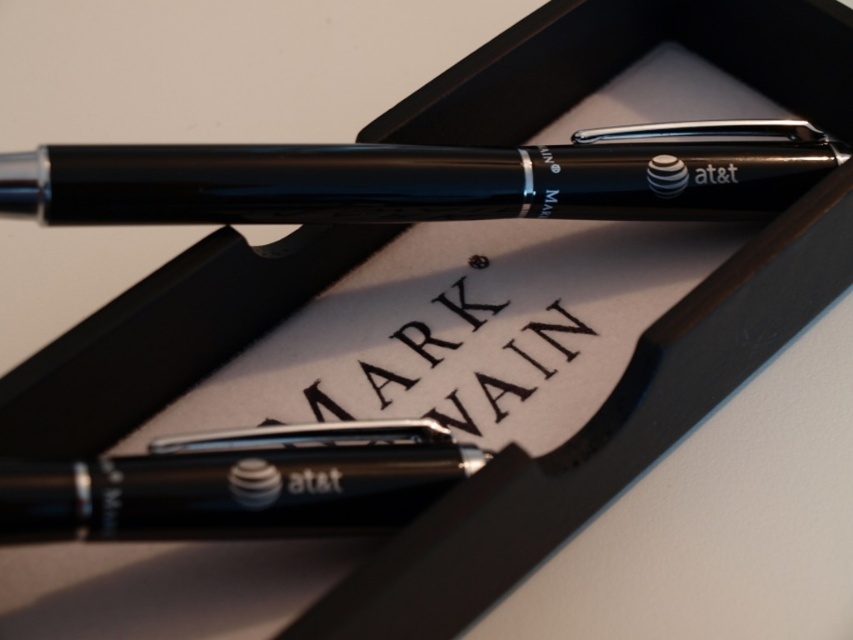
Question: Considering the relative positions of matte black pen at upper center and black metallic pen at center in the image provided, where is matte black pen at upper center located with respect to black metallic pen at center?

Choices:
 (A) below
 (B) above

Answer: (B)

Question: Which point is closer to the camera?

Choices:
 (A) black metallic pen at center
 (B) matte black pen at upper center

Answer: (A)

Question: Where is matte black pen at upper center located in relation to black metallic pen at center in the image?

Choices:
 (A) below
 (B) above

Answer: (B)

Question: Is matte black pen at upper center to the left of black metallic pen at center from the viewer's perspective?

Choices:
 (A) yes
 (B) no

Answer: (B)

Question: Which point appears closest to the camera in this image?

Choices:
 (A) (346, 220)
 (B) (318, 481)

Answer: (B)

Question: Which of the following is the farthest from the observer?

Choices:
 (A) pos(631,138)
 (B) pos(352,461)

Answer: (A)